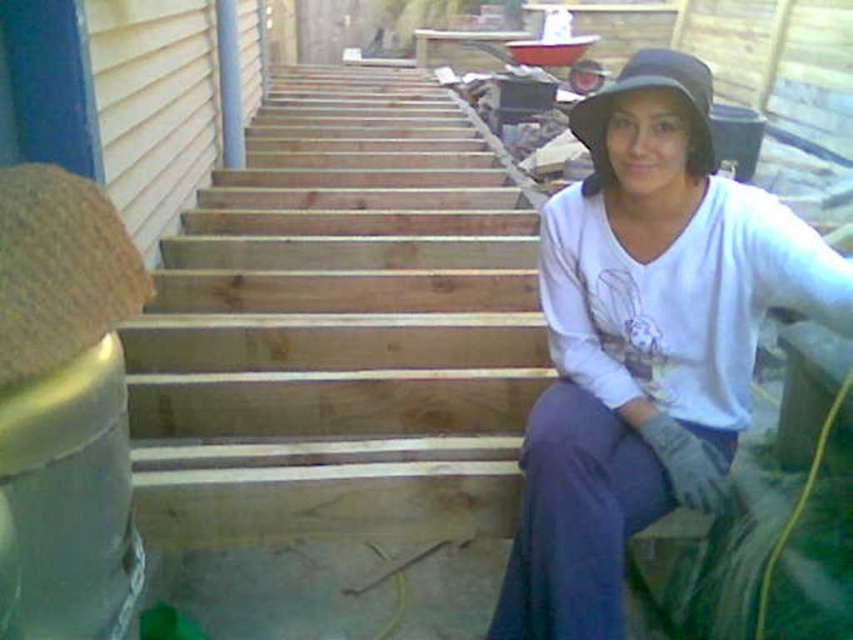
Consider the image. You are a contractor assessing the site. You need to retrieve the black fabric hat at upper right. Can you reach it without moving the natural wood stairs at center?

The black fabric hat at upper right is behind the natural wood stairs at center, so you cannot reach it without moving the natural wood stairs at center.

You are standing at the base of the wooden stairs and want to place a small tool on one of the two points mentioned. Which point is closer to you, point (643,76) or point (590,100)?

Point (643,76) is closer to the viewer than point (590,100), so you should place the tool there.